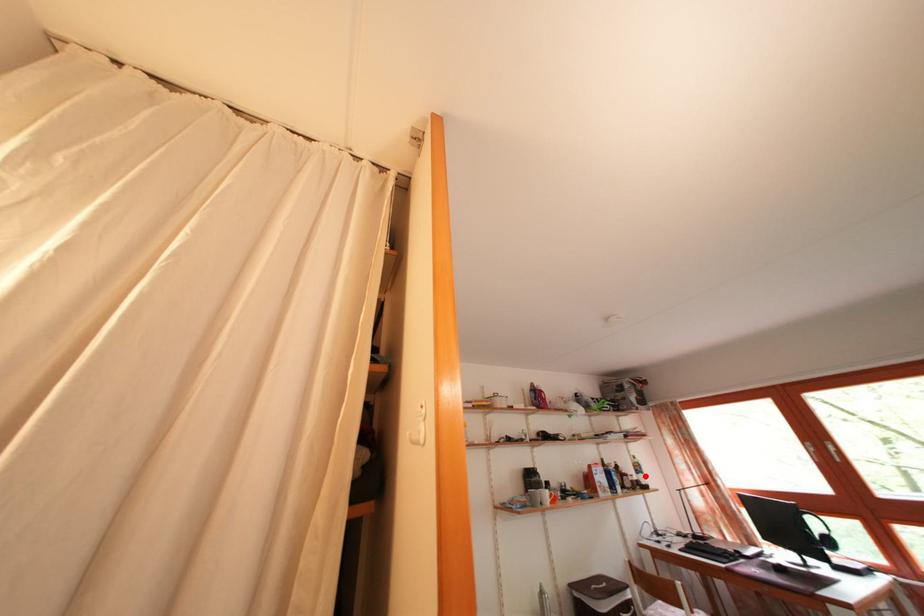
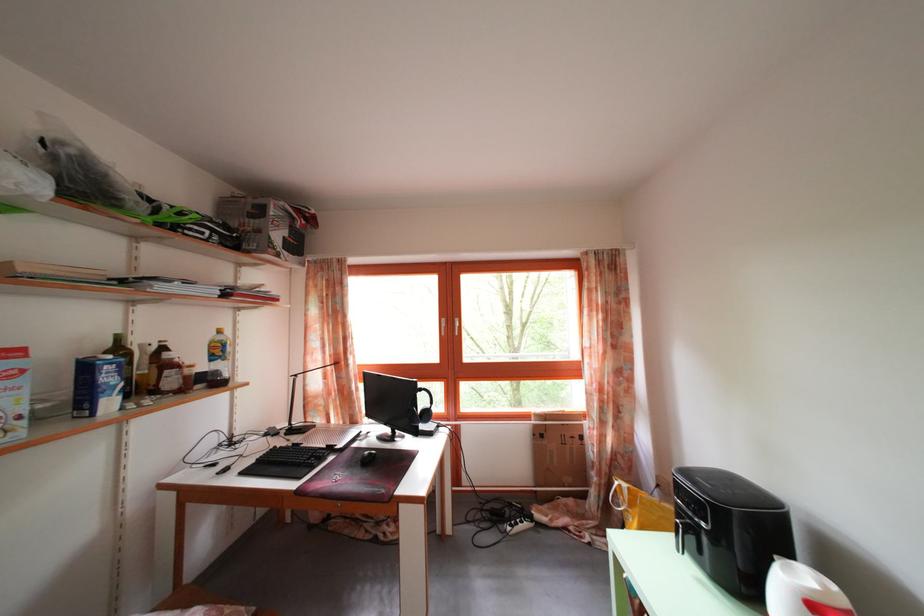
Question: I am providing you with two images of the same scene from different viewpoints. Image1 has a red point marked. In image2, the corresponding 3D location appears at what relative position? Reply with the corresponding letter.

Choices:
 (A) Closer
 (B) Farther

Answer: (A)